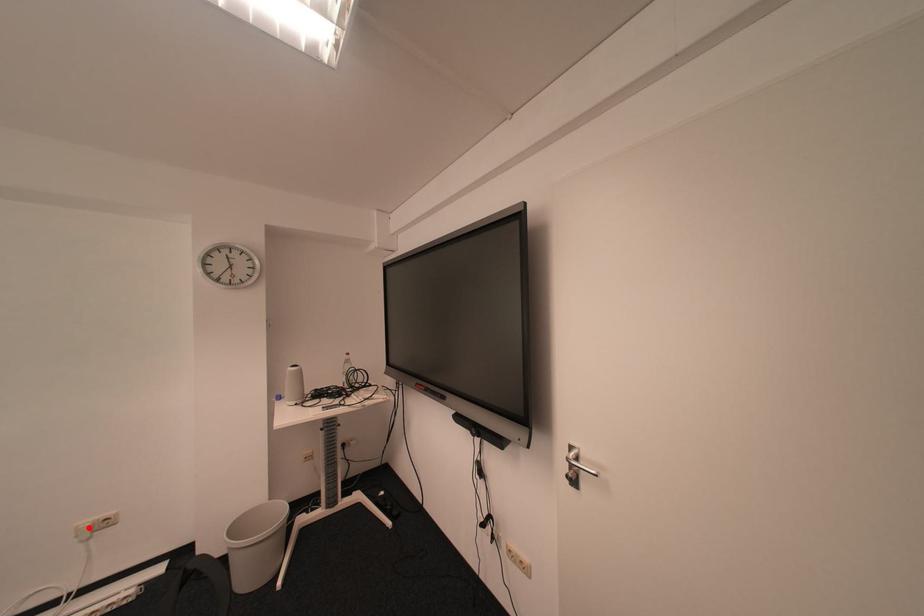
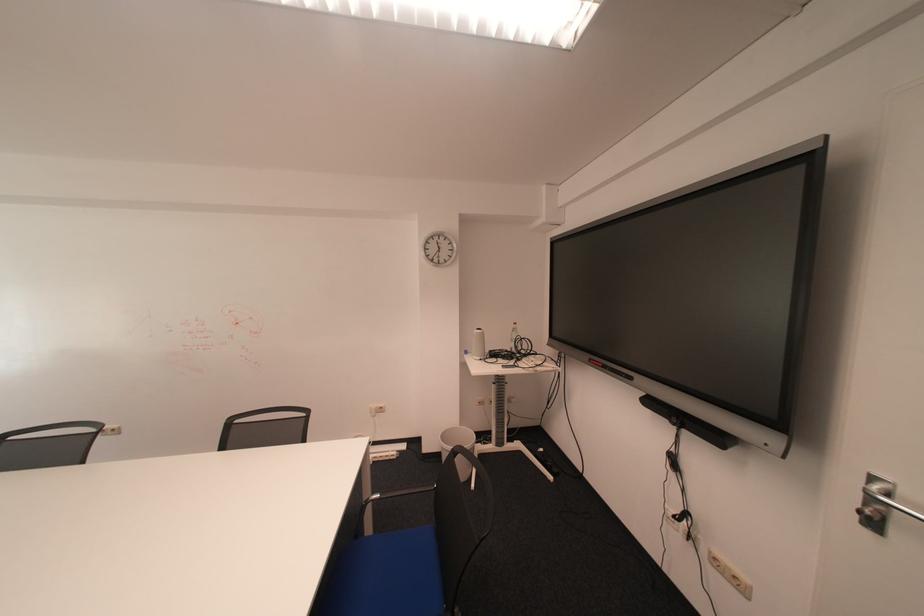
Where in the second image is the point corresponding to the highlighted location from the first image?

(382, 408)